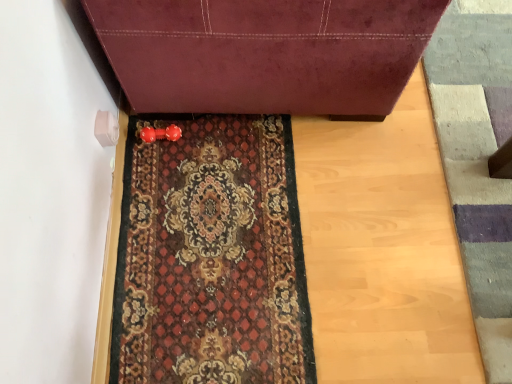
Consider the image. What is the approximate width of carpeted mat at center?

carpeted mat at center is 61.04 centimeters in width.

The width and height of the screenshot is (512, 384). What do you see at coordinates (211, 256) in the screenshot?
I see `carpeted mat at center` at bounding box center [211, 256].

The image size is (512, 384). In order to click on textured wool doormat at lower right in this screenshot , I will do `click(478, 160)`.

At what (x,y) coordinates should I click in order to perform the action: click on velvet burgundy sofa at center. Please return your answer as a coordinate pair (x, y). The width and height of the screenshot is (512, 384). Looking at the image, I should click on (264, 53).

Where is `carpeted mat at center`? carpeted mat at center is located at coordinates (211, 256).

Is carpeted mat at center next to textured wool doormat at lower right and touching it?

No, carpeted mat at center is not touching textured wool doormat at lower right.

From a real-world perspective, is carpeted mat at center physically below textured wool doormat at lower right?

Yes, from a real-world perspective, carpeted mat at center is beneath textured wool doormat at lower right.

Consider the image. Is carpeted mat at center looking in the opposite direction of textured wool doormat at lower right?

carpeted mat at center does not have its back to textured wool doormat at lower right.

Does carpeted mat at center have a lesser height compared to textured wool doormat at lower right?

Yes, carpeted mat at center is shorter than textured wool doormat at lower right.

Consider the image. Does textured wool doormat at lower right have a lesser height compared to velvet burgundy sofa at center?

Indeed, textured wool doormat at lower right has a lesser height compared to velvet burgundy sofa at center.

Which of these two, textured wool doormat at lower right or velvet burgundy sofa at center, is thinner?

textured wool doormat at lower right.

Is textured wool doormat at lower right to the left or to the right of velvet burgundy sofa at center in the image?

From the image, it's evident that textured wool doormat at lower right is to the right of velvet burgundy sofa at center.

From the image's perspective, which is above, textured wool doormat at lower right or velvet burgundy sofa at center?

velvet burgundy sofa at center is shown above in the image.

Identify the location of mat below the textured wool doormat at lower right (from a real-world perspective). (211, 256).

From a real-world perspective, between textured wool doormat at lower right and carpeted mat at center, who is vertically lower?

In real-world perspective, carpeted mat at center is lower.

Looking at their sizes, would you say textured wool doormat at lower right is wider or thinner than carpeted mat at center?

Considering their sizes, textured wool doormat at lower right looks slimmer than carpeted mat at center.

What's the angular difference between velvet burgundy sofa at center and carpeted mat at center's facing directions?

The angular difference between velvet burgundy sofa at center and carpeted mat at center is 3.13 degrees.

Between velvet burgundy sofa at center and carpeted mat at center, which one is positioned in front?

velvet burgundy sofa at center.

From the image's perspective, is velvet burgundy sofa at center located beneath carpeted mat at center?

No, from the image's perspective, velvet burgundy sofa at center is not beneath carpeted mat at center.

Considering the points (218, 152) and (207, 78), which point is behind, point (218, 152) or point (207, 78)?

Point (218, 152)

Is carpeted mat at center at the left side of velvet burgundy sofa at center?

Yes, carpeted mat at center is to the left of velvet burgundy sofa at center.

From a real-world perspective, between carpeted mat at center and velvet burgundy sofa at center, who is vertically lower?

carpeted mat at center.

Is there a large distance between carpeted mat at center and velvet burgundy sofa at center?

That's not correct — carpeted mat at center is a little close to velvet burgundy sofa at center.

Is velvet burgundy sofa at center not near textured wool doormat at lower right?

No.

Can textured wool doormat at lower right be found inside velvet burgundy sofa at center?

No, velvet burgundy sofa at center does not contain textured wool doormat at lower right.

Which of these two, velvet burgundy sofa at center or textured wool doormat at lower right, stands taller?

velvet burgundy sofa at center is taller.

Can you confirm if velvet burgundy sofa at center is smaller than textured wool doormat at lower right?

No.

Identify the location of doormat on the right of carpeted mat at center. This screenshot has height=384, width=512. click(x=478, y=160).

This screenshot has height=384, width=512. What are the coordinates of `furniture in front of the textured wool doormat at lower right` in the screenshot? It's located at (264, 53).

Looking at the image, which one is located further to textured wool doormat at lower right, velvet burgundy sofa at center or carpeted mat at center?

Based on the image, carpeted mat at center appears to be further to textured wool doormat at lower right.

Which object lies further to the anchor point carpeted mat at center, textured wool doormat at lower right or velvet burgundy sofa at center?

Based on the image, textured wool doormat at lower right appears to be further to carpeted mat at center.

Considering their positions, is carpeted mat at center positioned closer to velvet burgundy sofa at center than textured wool doormat at lower right?

The object closer to velvet burgundy sofa at center is carpeted mat at center.

Based on their spatial positions, is velvet burgundy sofa at center or textured wool doormat at lower right closer to carpeted mat at center?

velvet burgundy sofa at center is positioned closer to the anchor carpeted mat at center.

Looking at the image, which one is located further to textured wool doormat at lower right, carpeted mat at center or velvet burgundy sofa at center?

carpeted mat at center.

Considering their positions, is textured wool doormat at lower right positioned further to velvet burgundy sofa at center than carpeted mat at center?

Among the two, textured wool doormat at lower right is located further to velvet burgundy sofa at center.

Where is `furniture between carpeted mat at center and textured wool doormat at lower right`? The height and width of the screenshot is (384, 512). furniture between carpeted mat at center and textured wool doormat at lower right is located at coordinates (264, 53).